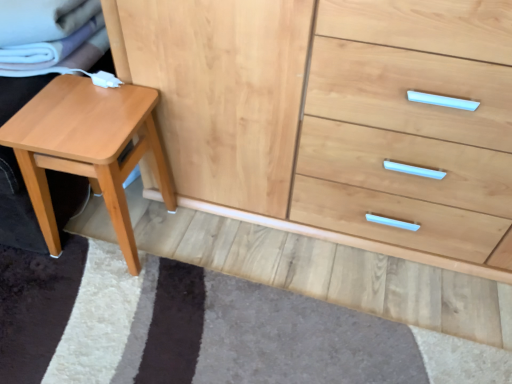
Locate an element on the screen. blank space situated above light brown wood stool at left (from a real-world perspective) is located at coordinates (79, 109).